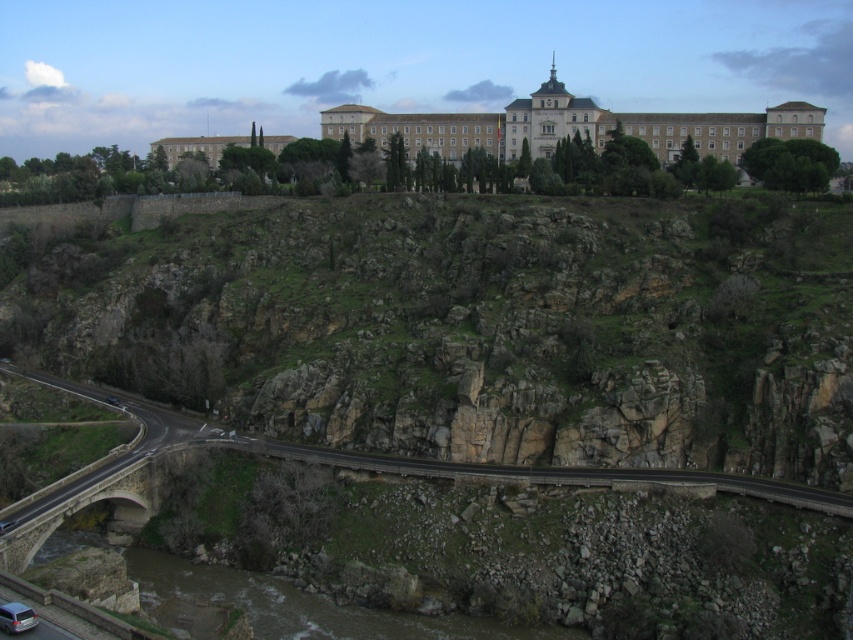
Is point (445, 620) farther from viewer compared to point (485, 472)?

No, it is not.

This screenshot has width=853, height=640. Describe the element at coordinates (306, 605) in the screenshot. I see `brown stone river at lower left` at that location.

Locate an element on the screen. The width and height of the screenshot is (853, 640). brown stone river at lower left is located at coordinates (306, 605).

At what (x,y) coordinates should I click in order to perform the action: click on brown stone river at lower left. Please return your answer as a coordinate pair (x, y). Looking at the image, I should click on (306, 605).